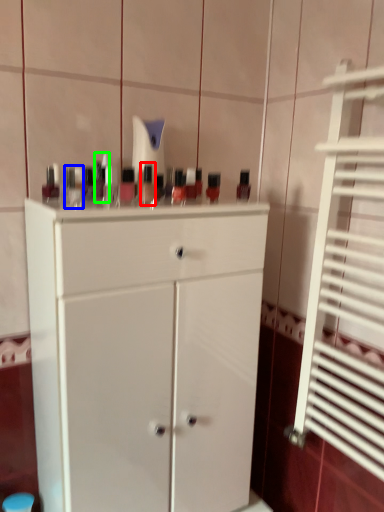
Question: Based on their relative distances, which object is nearer to mouthwash (highlighted by a red box)? Choose from toiletry (highlighted by a blue box) and toiletry (highlighted by a green box).

Choices:
 (A) toiletry
 (B) toiletry

Answer: (B)